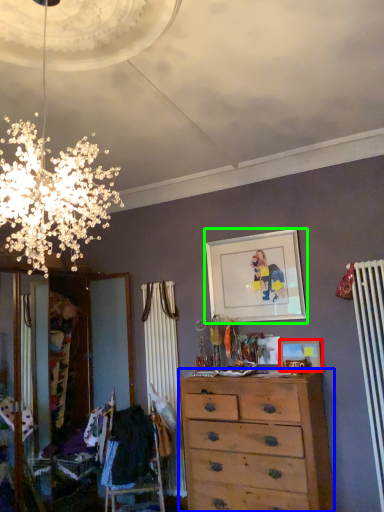
Question: Which object is positioned farthest from picture frame (highlighted by a red box)? Select from chest of drawers (highlighted by a blue box) and picture frame (highlighted by a green box).

Choices:
 (A) chest of drawers
 (B) picture frame

Answer: (A)